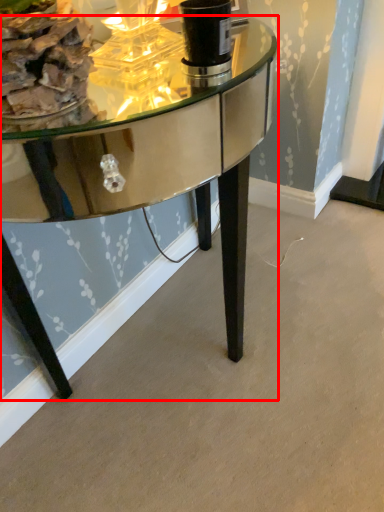
Question: From the image's perspective, where is table (annotated by the red box) located relative to food?

Choices:
 (A) below
 (B) above

Answer: (A)